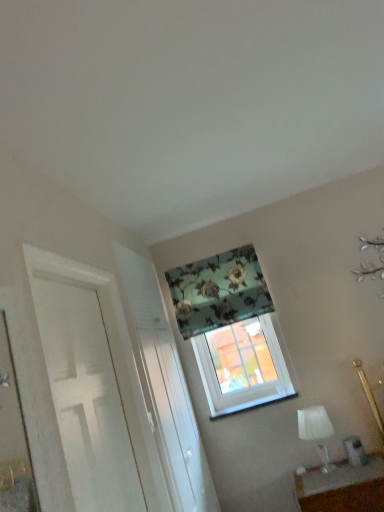
Image resolution: width=384 pixels, height=512 pixels. Describe the element at coordinates (253, 407) in the screenshot. I see `white plastic window sill at center` at that location.

In order to face white glass table lamp at lower right, should I rotate leftwards or rightwards?

You should rotate right by 16.378 degrees.

The image size is (384, 512). What are the coordinates of `white textured screen door at center` in the screenshot? It's located at (166, 387).

You are a GUI agent. You are given a task and a screenshot of the screen. Output one action in this format:
    pyautogui.click(x=<x>, y=<y>)
    Task: Click on the matte white table at lower right
    This screenshot has height=512, width=384.
    Given the screenshot: What is the action you would take?
    (343, 487)

This screenshot has width=384, height=512. In order to click on translucent glass window at center in this screenshot , I will do `click(242, 366)`.

You are a GUI agent. You are given a task and a screenshot of the screen. Output one action in this format:
    pyautogui.click(x=<x>, y=<y>)
    Task: Click on the floral fabric curtain at upper center
    The image size is (384, 512).
    Given the screenshot: What is the action you would take?
    pyautogui.click(x=218, y=291)

Is white painted wood door at left at the left side of white glass table lamp at lower right?

Yes, white painted wood door at left is to the left of white glass table lamp at lower right.

You are a GUI agent. You are given a task and a screenshot of the screen. Output one action in this format:
    pyautogui.click(x=<x>, y=<y>)
    Task: Click on the table lamp below the white painted wood door at left (from the image's perspective)
    The image size is (384, 512).
    Given the screenshot: What is the action you would take?
    pyautogui.click(x=316, y=432)

Is white painted wood door at left taller than white glass table lamp at lower right?

Yes, white painted wood door at left is taller than white glass table lamp at lower right.

Is white painted wood door at left not near white glass table lamp at lower right?

white painted wood door at left is positioned a significant distance from white glass table lamp at lower right.

Which object is closer to the camera, white textured screen door at center or white painted wood door at left?

white painted wood door at left.

Between white textured screen door at center and white painted wood door at left, which one has larger width?

white painted wood door at left is wider.

Is white textured screen door at center to the right of white painted wood door at left from the viewer's perspective?

Indeed, white textured screen door at center is positioned on the right side of white painted wood door at left.

What are the coordinates of `door lying on the left of matte white table at lower right` in the screenshot? It's located at tap(87, 398).

From a real-world perspective, does matte white table at lower right stand above white painted wood door at left?

No.

Which is more to the left, matte white table at lower right or white painted wood door at left?

Positioned to the left is white painted wood door at left.

From the image's perspective, between matte white table at lower right and white painted wood door at left, who is located below?

matte white table at lower right is shown below in the image.

Is point (322, 421) closer to camera compared to point (318, 487)?

No.

Which of these two, white glass table lamp at lower right or matte white table at lower right, stands shorter?

matte white table at lower right is shorter.

Does white glass table lamp at lower right have a greater width compared to matte white table at lower right?

No, white glass table lamp at lower right is not wider than matte white table at lower right.

Considering the relative sizes of white glass table lamp at lower right and matte white table at lower right in the image provided, is white glass table lamp at lower right bigger than matte white table at lower right?

Actually, white glass table lamp at lower right might be smaller than matte white table at lower right.

Is white glass table lamp at lower right beside white painted wood door at left?

They are not placed beside each other.

From the image's perspective, between white glass table lamp at lower right and white painted wood door at left, who is located below?

white glass table lamp at lower right, from the image's perspective.

From a real-world perspective, is white glass table lamp at lower right on white painted wood door at left?

No, from a real-world perspective, white glass table lamp at lower right is not above white painted wood door at left.

Which is more to the left, white glass table lamp at lower right or white painted wood door at left?

white painted wood door at left is more to the left.

Identify the location of screen door below the translucent glass window at center (from the image's perspective). (166, 387).

Is translucent glass window at center far from white textured screen door at center?

translucent glass window at center is actually quite close to white textured screen door at center.

Which is more to the right, translucent glass window at center or white textured screen door at center?

translucent glass window at center.

Is translucent glass window at center positioned with its back to white textured screen door at center?

No, translucent glass window at center is not facing away from white textured screen door at center.

In the image, is white glass table lamp at lower right positioned in front of or behind white plastic window sill at center?

Visually, white glass table lamp at lower right is located in front of white plastic window sill at center.

In the scene shown: Is white glass table lamp at lower right oriented towards white plastic window sill at center?

No, white glass table lamp at lower right is not turned towards white plastic window sill at center.

Considering the relative sizes of white glass table lamp at lower right and white plastic window sill at center in the image provided, is white glass table lamp at lower right taller than white plastic window sill at center?

Indeed, white glass table lamp at lower right has a greater height compared to white plastic window sill at center.

In terms of size, does white glass table lamp at lower right appear bigger or smaller than white plastic window sill at center?

white glass table lamp at lower right is bigger than white plastic window sill at center.

Locate an element on the screen. The height and width of the screenshot is (512, 384). door above the white glass table lamp at lower right (from a real-world perspective) is located at coordinates (87, 398).

Where is `door in front of the white textured screen door at center`? door in front of the white textured screen door at center is located at coordinates (87, 398).

From the image, which object appears to be nearer to translucent glass window at center, white glass table lamp at lower right or white textured screen door at center?

white glass table lamp at lower right lies closer to translucent glass window at center than the other object.

From the image, which object appears to be farther from translucent glass window at center, white textured screen door at center or white painted wood door at left?

white painted wood door at left lies further to translucent glass window at center than the other object.

Considering their positions, is white painted wood door at left positioned further to floral fabric curtain at upper center than white plastic window sill at center?

white painted wood door at left is further to floral fabric curtain at upper center.

Looking at the image, which one is located closer to white textured screen door at center, matte white table at lower right or white glass table lamp at lower right?

matte white table at lower right is positioned closer to the anchor white textured screen door at center.

From the image, which object appears to be nearer to white glass table lamp at lower right, translucent glass window at center or white plastic window sill at center?

The object closer to white glass table lamp at lower right is white plastic window sill at center.

When comparing their distances from floral fabric curtain at upper center, does white painted wood door at left or white textured screen door at center seem further?

white painted wood door at left is positioned further to the anchor floral fabric curtain at upper center.

When comparing their distances from white painted wood door at left, does white plastic window sill at center or white textured screen door at center seem further?

white plastic window sill at center is further to white painted wood door at left.

Estimate the real-world distances between objects in this image. Which object is closer to white painted wood door at left, white plastic window sill at center or translucent glass window at center?

translucent glass window at center.

At what (x,y) coordinates should I click in order to perform the action: click on table lamp between white painted wood door at left and floral fabric curtain at upper center from front to back. Please return your answer as a coordinate pair (x, y). The width and height of the screenshot is (384, 512). Looking at the image, I should click on (316, 432).

You are a GUI agent. You are given a task and a screenshot of the screen. Output one action in this format:
    pyautogui.click(x=<x>, y=<y>)
    Task: Click on the screen door between white painted wood door at left and matte white table at lower right from left to right
    The width and height of the screenshot is (384, 512).
    Given the screenshot: What is the action you would take?
    [166, 387]

At what (x,y) coordinates should I click in order to perform the action: click on window sill located between matte white table at lower right and translucent glass window at center in the depth direction. Please return your answer as a coordinate pair (x, y). The image size is (384, 512). Looking at the image, I should click on (253, 407).

You are a GUI agent. You are given a task and a screenshot of the screen. Output one action in this format:
    pyautogui.click(x=<x>, y=<y>)
    Task: Click on the window sill between floral fabric curtain at upper center and white glass table lamp at lower right from top to bottom
    
    Given the screenshot: What is the action you would take?
    pyautogui.click(x=253, y=407)